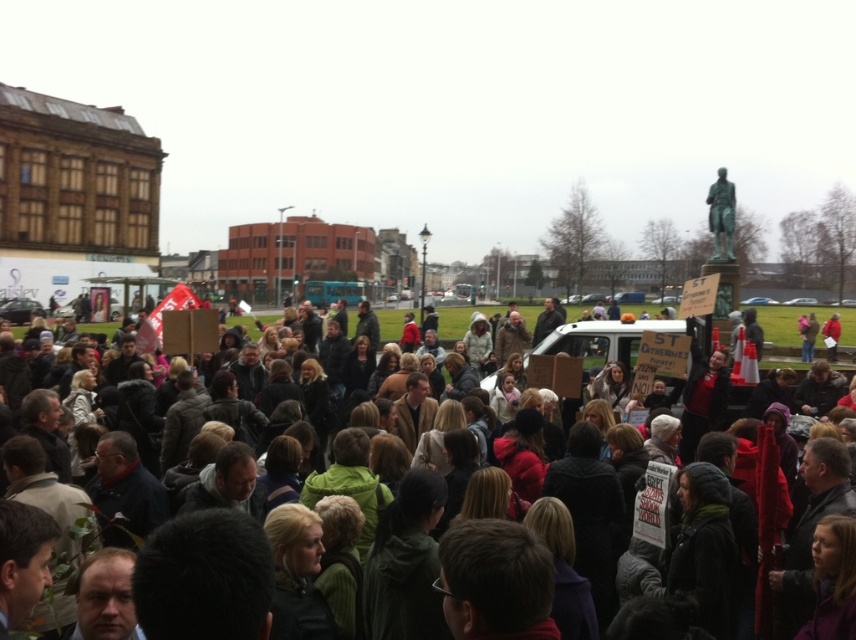
You are a photographer trying to capture the crowd and the statue in the same frame. Based on the scene, can you determine if the dark gray clothing at center is positioned below the green polished statue at upper right?

Yes, the dark gray clothing at center is located below the green polished statue at upper right, so they can be captured in the same frame with the statue above the clothing in the composition.

You are part of a group of protesters in the public square. You notice two key elements in the scene described in the image. One is the dark gray clothing at center, and the other is the green polished statue at upper right. From your vantage point, which of these two items is located to the left of the other?

The dark gray clothing at center is positioned on the left side of the green polished statue at upper right.